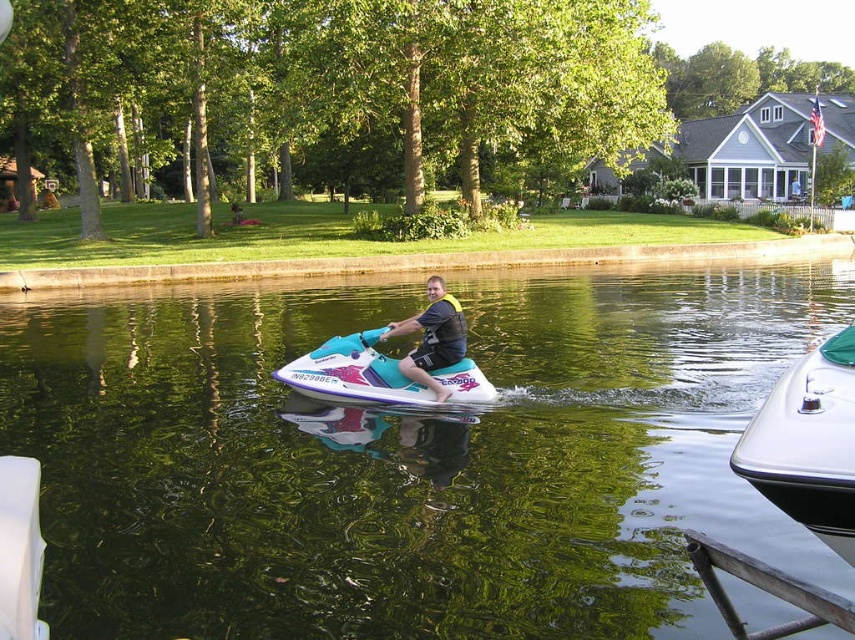
Question: Which of the following is the closest to the observer?

Choices:
 (A) teal matte jet ski at center
 (B) white glossy boat at lower right

Answer: (B)

Question: Which point is closer to the camera?

Choices:
 (A) green reflective water at center
 (B) matte black life vest at center
 (C) white glossy boat at lower right

Answer: (C)

Question: Which object is positioned closest to the teal matte jet ski at center?

Choices:
 (A) green reflective water at center
 (B) matte black life vest at center
 (C) white glossy boat at lower right

Answer: (B)

Question: Does green reflective water at center appear under matte black life vest at center?

Choices:
 (A) yes
 (B) no

Answer: (B)

Question: Can you confirm if white glossy boat at lower right is positioned to the left of matte black life vest at center?

Choices:
 (A) yes
 (B) no

Answer: (B)

Question: Does green reflective water at center appear on the left side of white glossy boat at lower right?

Choices:
 (A) no
 (B) yes

Answer: (B)